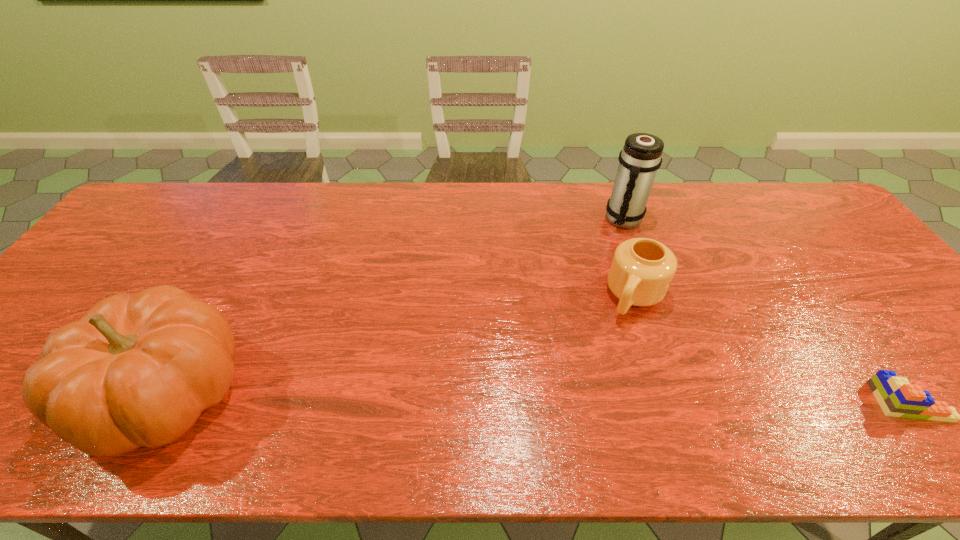
Locate an element on the screen. This screenshot has height=540, width=960. pumpkin is located at coordinates (137, 370).

The image size is (960, 540). In order to click on the shortest object in this screenshot , I will do `click(896, 396)`.

Identify the location of the rightmost object. The width and height of the screenshot is (960, 540). (896, 396).

Identify the location of the third nearest object. The image size is (960, 540). (642, 269).

Identify the location of mug. Image resolution: width=960 pixels, height=540 pixels. (x=642, y=269).

Locate an element on the screen. the farthest object is located at coordinates (641, 156).

Where is `vacant space situated 0.160m on the back of the leftmost object`? Image resolution: width=960 pixels, height=540 pixels. vacant space situated 0.160m on the back of the leftmost object is located at coordinates (228, 281).

In order to click on free spot located on the left of the shortest object in this screenshot , I will do `click(747, 401)`.

Find the location of `vacant space positioned on the handle side of the second shortest object`. vacant space positioned on the handle side of the second shortest object is located at coordinates (586, 398).

You are a GUI agent. You are given a task and a screenshot of the screen. Output one action in this format:
    pyautogui.click(x=<x>, y=<y>)
    Task: Click on the vacant area located on the handle side of the second shortest object
    
    Given the screenshot: What is the action you would take?
    pyautogui.click(x=596, y=377)